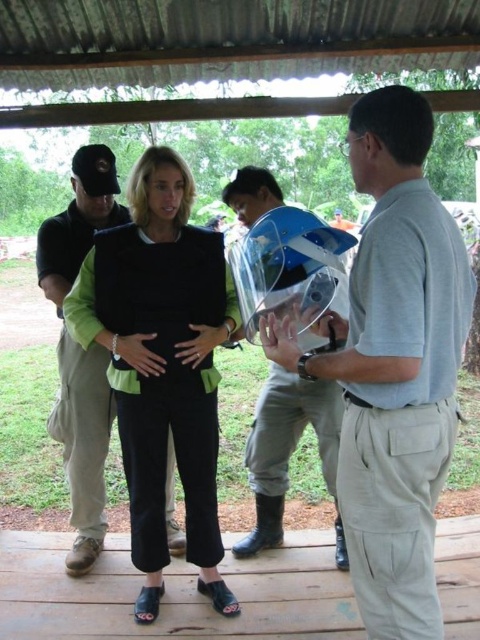
Question: Is black matte vest at center thinner than clear plastic helmet at center?

Choices:
 (A) no
 (B) yes

Answer: (A)

Question: Where is light gray cotton shirt at right located in relation to clear plastic helmet at center in the image?

Choices:
 (A) above
 (B) below

Answer: (A)

Question: Can you confirm if black matte vest at center is wider than clear plastic helmet at center?

Choices:
 (A) no
 (B) yes

Answer: (B)

Question: Which object appears closest to the camera in this image?

Choices:
 (A) black matte vest at center
 (B) clear plastic helmet at center
 (C) light gray cotton shirt at right

Answer: (C)

Question: Which point is closer to the camera?

Choices:
 (A) light gray cotton shirt at right
 (B) clear plastic helmet at center

Answer: (A)

Question: Which point is farther from the camera taking this photo?

Choices:
 (A) (408, 436)
 (B) (193, 528)
 (C) (335, 301)

Answer: (B)